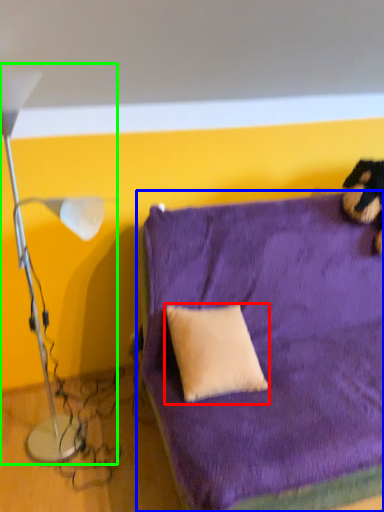
Question: Considering the real-world distances, which object is farthest from pillow (highlighted by a red box)? furniture (highlighted by a blue box) or lamp (highlighted by a green box)?

Choices:
 (A) furniture
 (B) lamp

Answer: (B)